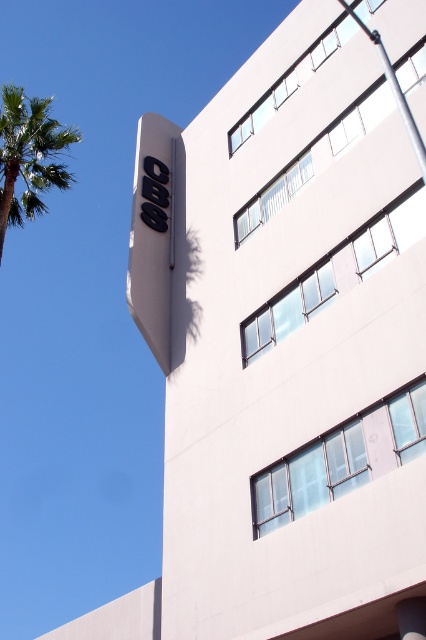
Can you confirm if black matte sign at upper left is taller than silver metallic pole at upper right?

Yes, black matte sign at upper left is taller than silver metallic pole at upper right.

Between point (161, 193) and point (385, 60), which one is positioned in front?

Positioned in front is point (385, 60).

Is point (144, 284) farther from camera compared to point (345, 3)?

Yes.

Where is `black matte sign at upper left`? Image resolution: width=426 pixels, height=640 pixels. black matte sign at upper left is located at coordinates (152, 234).

Consider the image. Can you confirm if green leafy palm tree at left is smaller than silver metallic pole at upper right?

No.

Is green leafy palm tree at left positioned behind silver metallic pole at upper right?

Yes, it is behind silver metallic pole at upper right.

Is point (20, 104) less distant than point (423, 160)?

No, it is not.

What are the coordinates of `green leafy palm tree at left` in the screenshot? It's located at (28, 156).

Find the location of a particular element. This screenshot has width=426, height=640. black matte sign at upper left is located at coordinates (152, 234).

Is point (169, 316) farther from viewer compared to point (36, 188)?

No, (169, 316) is closer to viewer.

This screenshot has height=640, width=426. I want to click on black matte sign at upper left, so click(152, 234).

Locate an element on the screen. This screenshot has height=640, width=426. black matte sign at upper left is located at coordinates (152, 234).